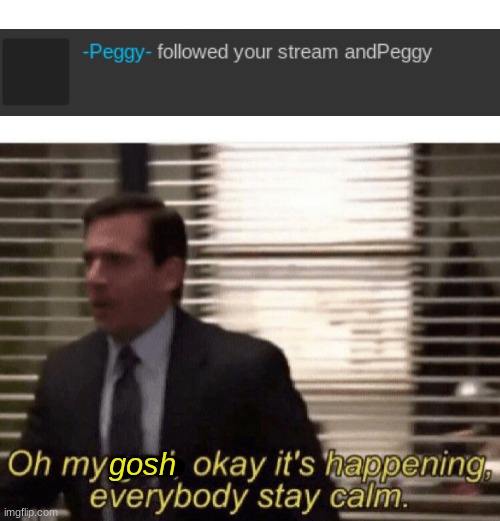
Image resolution: width=500 pixels, height=521 pixels. I want to click on blinds, so click(302, 287).